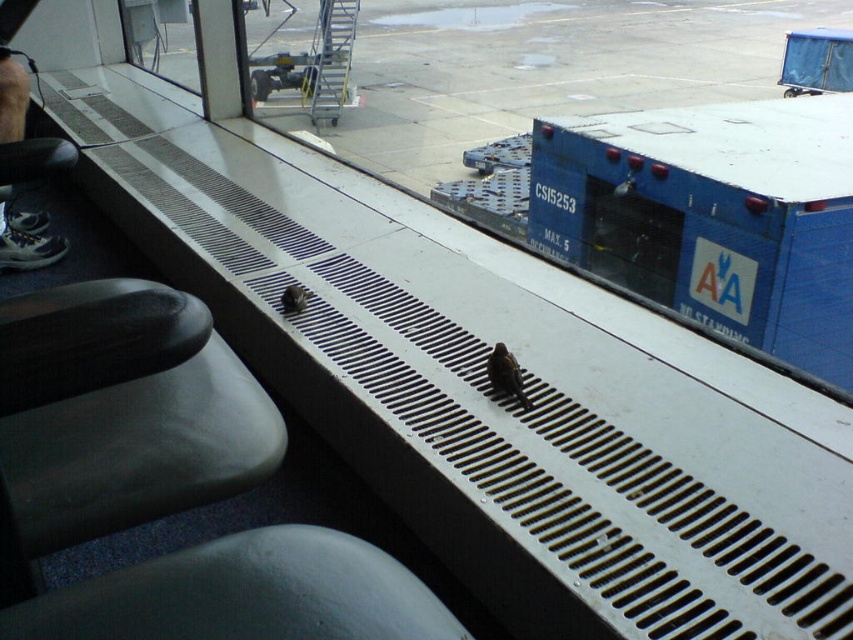
Question: Is gray concrete tarmac at center to the right of leather shoe at left from the viewer's perspective?

Choices:
 (A) no
 (B) yes

Answer: (B)

Question: Is blue matte cargo container at center above leather shoe at left?

Choices:
 (A) yes
 (B) no

Answer: (B)

Question: Which object is farther from the camera taking this photo?

Choices:
 (A) transparent glass window at upper left
 (B) leather shoe at left

Answer: (A)

Question: Can you confirm if gray concrete tarmac at center is positioned to the right of transparent glass window at upper left?

Choices:
 (A) yes
 (B) no

Answer: (A)

Question: Which object is the farthest from the blue matte cargo container at center?

Choices:
 (A) smooth gray seat at lower left
 (B) transparent glass window at upper left

Answer: (A)

Question: Which of the following is the farthest from the observer?

Choices:
 (A) smooth gray seat at lower left
 (B) gray concrete tarmac at center
 (C) blue matte cargo container at center
 (D) transparent glass window at upper left

Answer: (B)